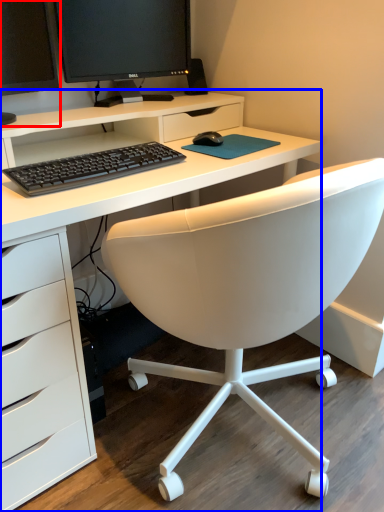
Question: Which object is closer to the camera taking this photo, computer monitor (highlighted by a red box) or desk (highlighted by a blue box)?

Choices:
 (A) computer monitor
 (B) desk

Answer: (B)